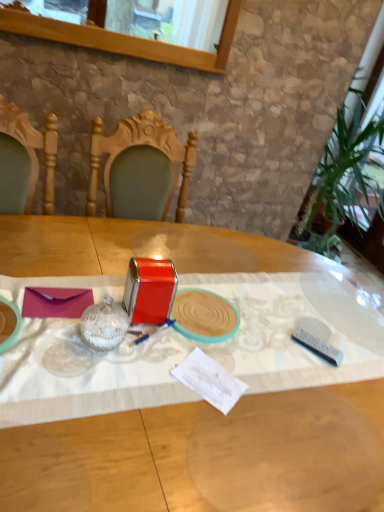
You are a GUI agent. You are given a task and a screenshot of the screen. Output one action in this format:
    pyautogui.click(x=<x>, y=<y>)
    Task: Click on the free space to the back side of white plastic remote at lower right, the first tableware when ordered from right to left
    This screenshot has height=512, width=384.
    Given the screenshot: What is the action you would take?
    pyautogui.click(x=309, y=310)